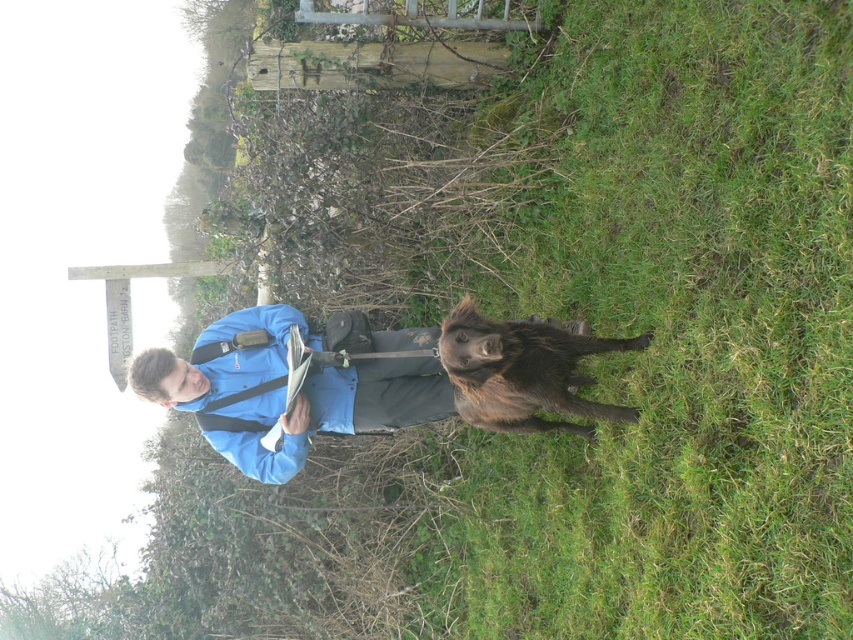
You are planning to set up a small tent on the green grass at center and the blue fabric jacket at center. Which location would provide enough space for the tent?

The green grass at center has a larger size compared to the blue fabric jacket at center, so the green grass at center would provide enough space for the tent.

You are standing at point (576, 406) and want to walk towards the camera. Which direction should you move to reach the camera without passing through point (595, 268)?

You should move towards the direction of point (595, 268) because it is closer to the camera than point (576, 406). Since point (595, 268) is already further towards the camera, moving in that direction would allow you to reach the camera without passing through the other point.

You are standing in the scene and want to step onto the green grass at center. Where should you look to find the brown furry dog at center?

The brown furry dog at center is below the green grass at center.